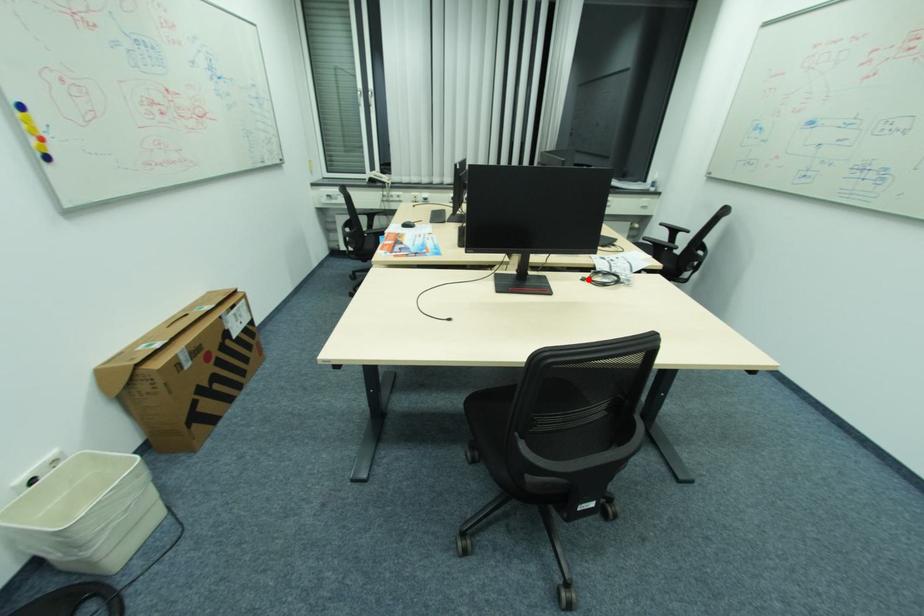
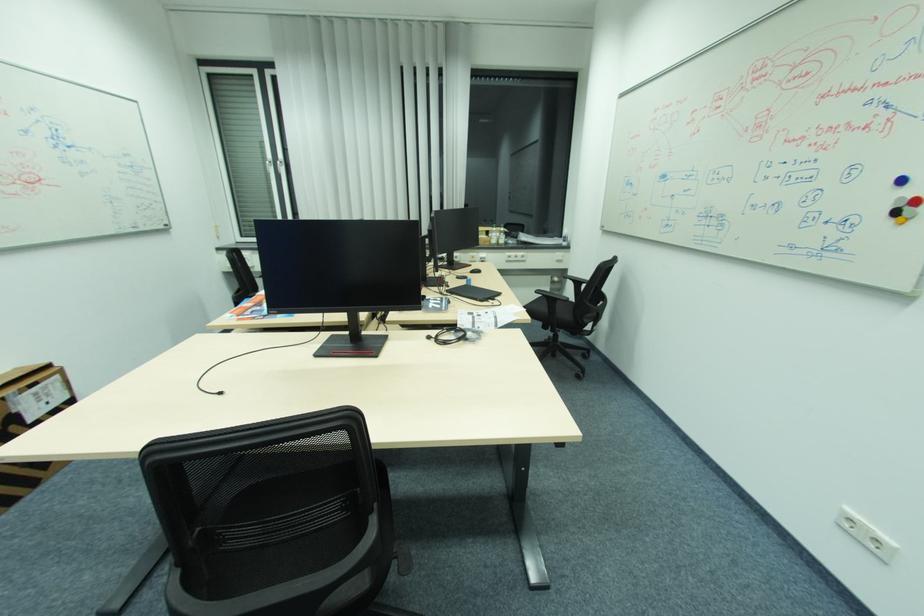
Where in the second image is the point corresponding to the highlighted location from the first image?

(434, 338)